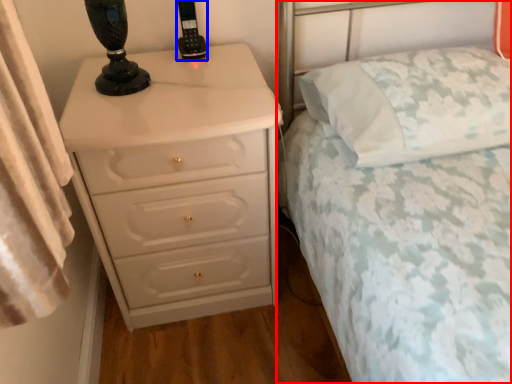
Question: Which point is further to the camera, bed (highlighted by a red box) or control (highlighted by a blue box)?

Choices:
 (A) bed
 (B) control

Answer: (B)